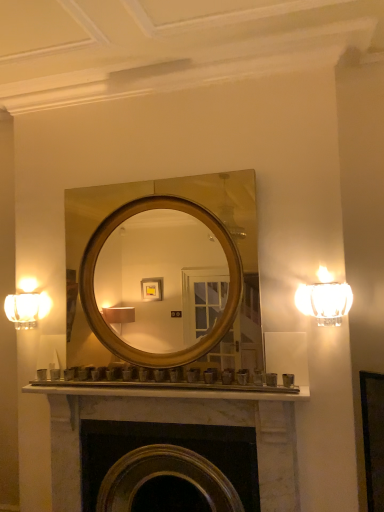
Question: Is marble fireplace at center to the right of matte glass sconce at left from the viewer's perspective?

Choices:
 (A) no
 (B) yes

Answer: (B)

Question: From a real-world perspective, is marble fireplace at center below matte glass sconce at left?

Choices:
 (A) yes
 (B) no

Answer: (A)

Question: Does marble fireplace at center come behind matte glass sconce at left?

Choices:
 (A) yes
 (B) no

Answer: (B)

Question: Is marble fireplace at center looking in the opposite direction of matte glass sconce at left?

Choices:
 (A) no
 (B) yes

Answer: (A)

Question: Considering the relative sizes of marble fireplace at center and matte glass sconce at left in the image provided, is marble fireplace at center bigger than matte glass sconce at left?

Choices:
 (A) yes
 (B) no

Answer: (A)

Question: Considering the relative positions of clear glass sconce at right and matte glass sconce at left in the image provided, is clear glass sconce at right to the left or to the right of matte glass sconce at left?

Choices:
 (A) right
 (B) left

Answer: (A)

Question: From the image's perspective, relative to matte glass sconce at left, is clear glass sconce at right above or below?

Choices:
 (A) above
 (B) below

Answer: (A)

Question: Is clear glass sconce at right wider or thinner than matte glass sconce at left?

Choices:
 (A) thin
 (B) wide

Answer: (B)

Question: From a real-world perspective, is clear glass sconce at right physically located above or below matte glass sconce at left?

Choices:
 (A) below
 (B) above

Answer: (B)

Question: Considering the positions of marble fireplace at center and clear glass sconce at right in the image, is marble fireplace at center bigger or smaller than clear glass sconce at right?

Choices:
 (A) small
 (B) big

Answer: (B)

Question: Relative to clear glass sconce at right, is marble fireplace at center in front or behind?

Choices:
 (A) front
 (B) behind

Answer: (B)

Question: From a real-world perspective, is marble fireplace at center physically located above or below clear glass sconce at right?

Choices:
 (A) above
 (B) below

Answer: (B)

Question: From the image's perspective, is marble fireplace at center positioned above or below clear glass sconce at right?

Choices:
 (A) above
 (B) below

Answer: (B)

Question: Relative to gold/metallic mirror at center, is clear glass sconce at right in front or behind?

Choices:
 (A) behind
 (B) front

Answer: (B)

Question: From a real-world perspective, is clear glass sconce at right above or below gold/metallic mirror at center?

Choices:
 (A) below
 (B) above

Answer: (A)